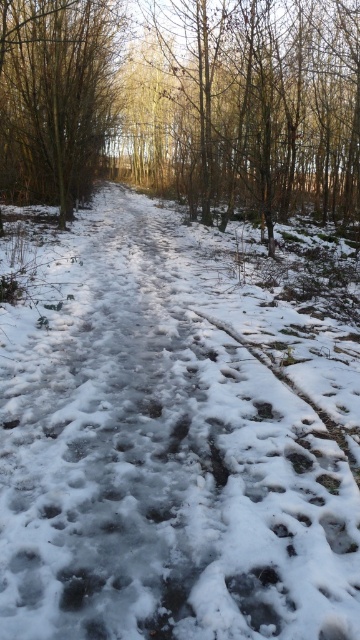
Question: Can you confirm if white frosty path at center is smaller than brown textured tree at upper left?

Choices:
 (A) no
 (B) yes

Answer: (A)

Question: Is brown/dry wood at upper center above brown textured tree at upper left?

Choices:
 (A) no
 (B) yes

Answer: (B)

Question: Among these points, which one is nearest to the camera?

Choices:
 (A) 277,273
 (B) 70,202
 (C) 168,58

Answer: (A)

Question: Is white frosty path at center bigger than brown textured tree at upper left?

Choices:
 (A) no
 (B) yes

Answer: (B)

Question: Considering the real-world distances, which object is closest to the brown textured tree at upper left?

Choices:
 (A) white frosty path at center
 (B) brown/dry wood at upper center

Answer: (B)

Question: Which point is closer to the camera taking this photo?

Choices:
 (A) (97, 412)
 (B) (79, 33)
 (C) (262, 3)

Answer: (A)